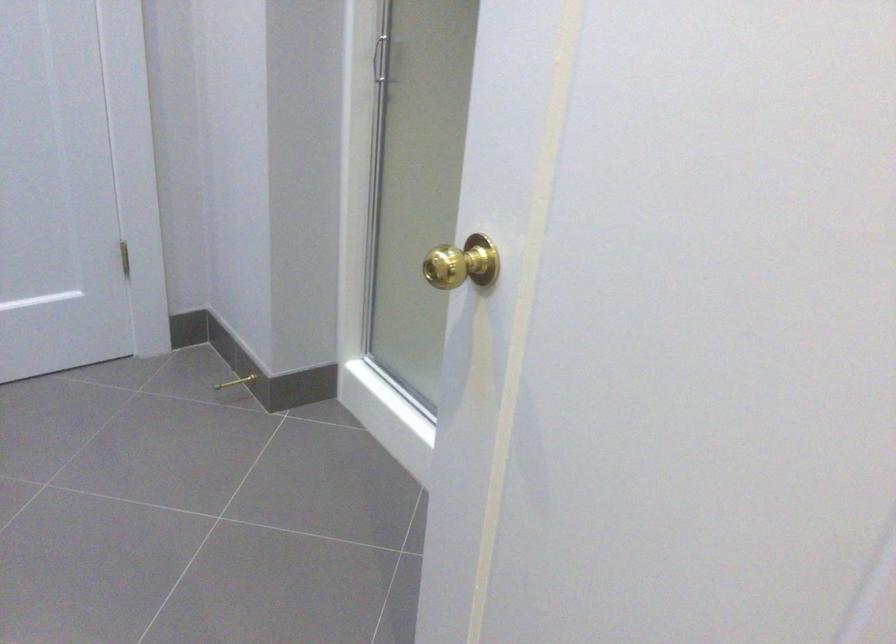
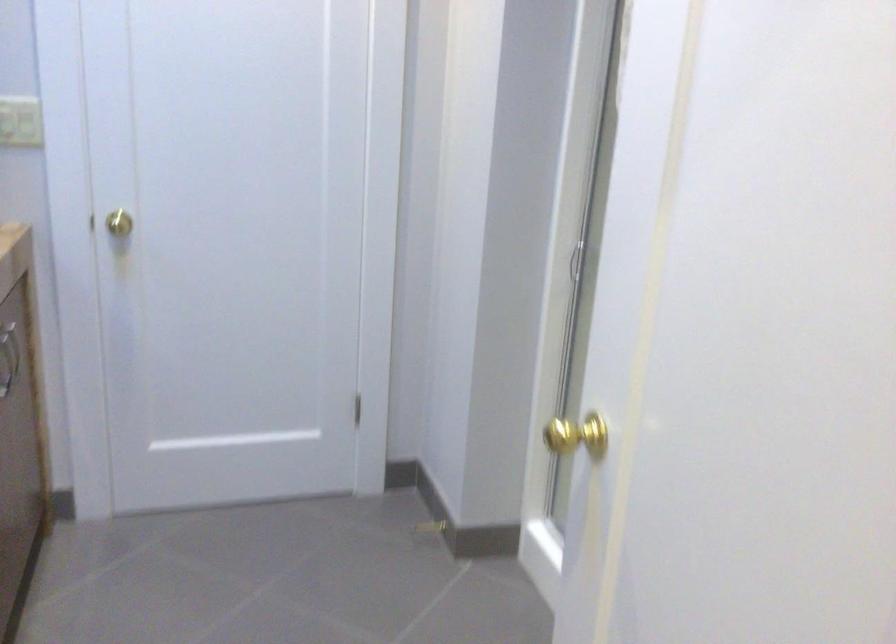
Question: The camera is either moving clockwise (left) or counter-clockwise (right) around the object. The first image is from the beginning of the video and the second image is from the end. Is the camera moving left or right when shooting the video?

Choices:
 (A) Left
 (B) Right

Answer: (B)